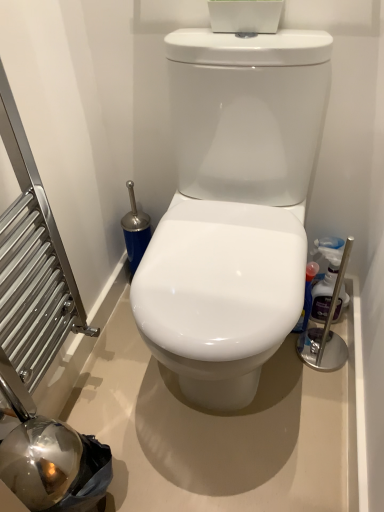
Identify the location of free space on the front side of glossy plastic spray bottle at right, the first cleaning product positioned from the left. The height and width of the screenshot is (512, 384). (302, 373).